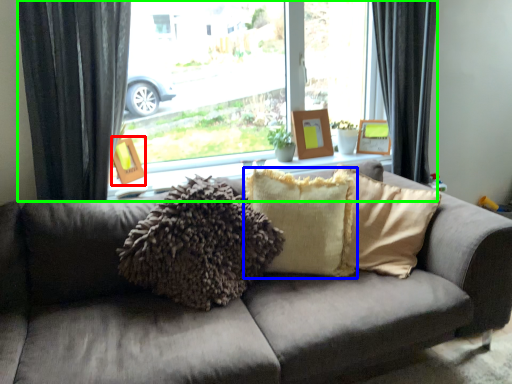
Question: Which is nearer to the picture frame (highlighted by a red box)? pillow (highlighted by a blue box) or window (highlighted by a green box).

Choices:
 (A) pillow
 (B) window

Answer: (B)